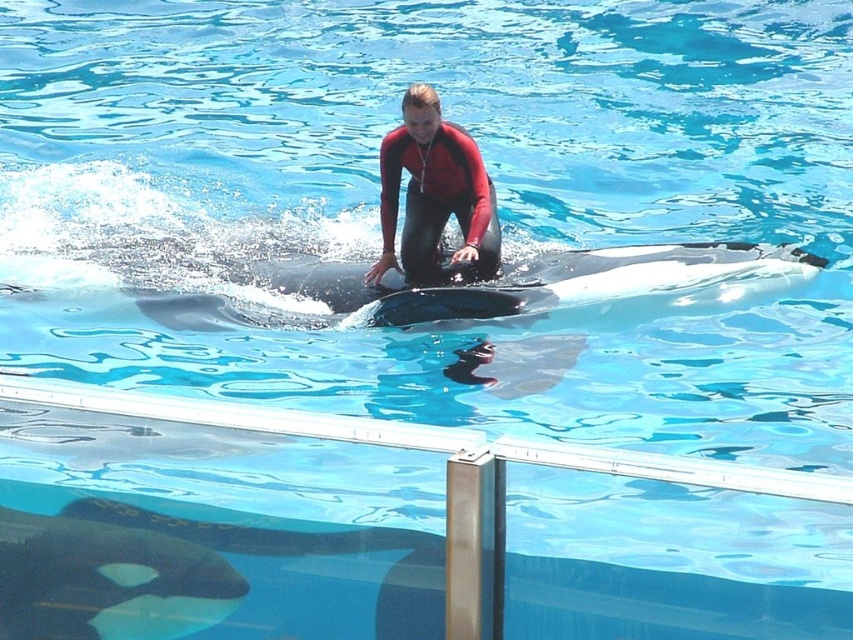
You are a safety inspector at the marine park. You need to ensure that the distance between the black smooth whale at lower center and the red matte wetsuit at center meets the safety protocol which requires a minimum of 10 meters. Is the current distance compliant?

The distance between the black smooth whale at lower center and the red matte wetsuit at center is 10.55 meters, which exceeds the required 10 meters, so it is compliant with the safety protocol.

You are a marine biologist observing the interaction between the black smooth whale at lower center and the red matte wetsuit at center. Based on their positions, which object is positioned lower in the image?

The black smooth whale at lower center is located below the red matte wetsuit at center, so it is positioned lower in the image.